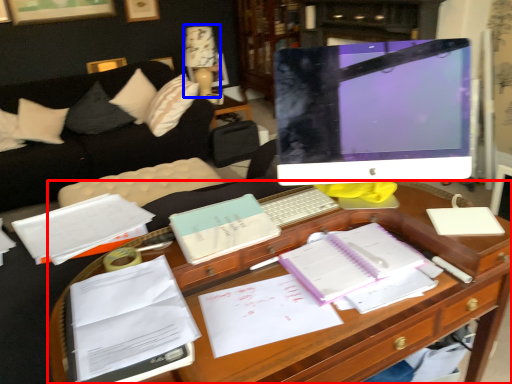
Question: Which point is further to the camera, desk (highlighted by a red box) or table lamp (highlighted by a blue box)?

Choices:
 (A) desk
 (B) table lamp

Answer: (B)